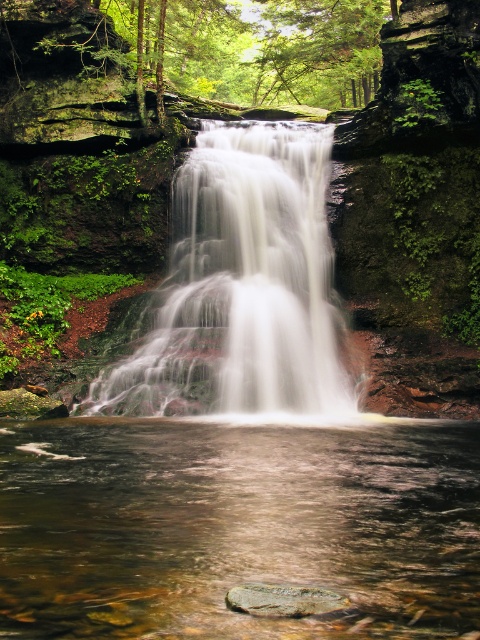
Question: Is translucent water at center above smooth brown rock at center?

Choices:
 (A) yes
 (B) no

Answer: (B)

Question: Is translucent water at center wider than smooth brown rock at center?

Choices:
 (A) no
 (B) yes

Answer: (B)

Question: Among these objects, which one is nearest to the camera?

Choices:
 (A) white smooth waterfall at center
 (B) translucent water at center

Answer: (B)

Question: Does white smooth waterfall at center appear on the right side of smooth brown rock at center?

Choices:
 (A) no
 (B) yes

Answer: (B)

Question: Which object is positioned farthest from the translucent water at center?

Choices:
 (A) white smooth waterfall at center
 (B) smooth brown rock at center

Answer: (A)

Question: Which object is the farthest from the translucent water at center?

Choices:
 (A) smooth brown rock at center
 (B) white smooth waterfall at center

Answer: (B)